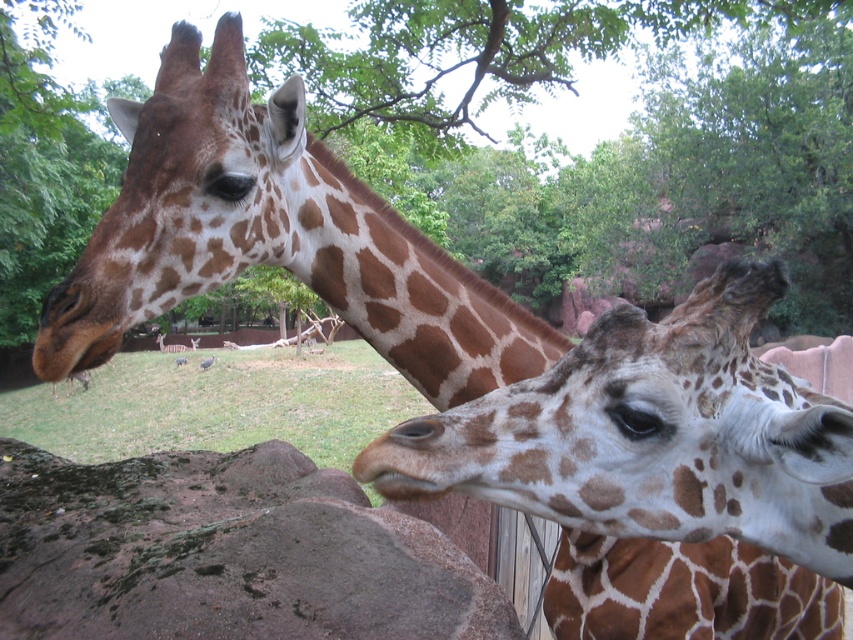
Question: Is spotted fur at center in front of brown rough rock at lower left?

Choices:
 (A) no
 (B) yes

Answer: (B)

Question: Is spotted fur at center positioned at the back of brown rough rock at lower left?

Choices:
 (A) no
 (B) yes

Answer: (A)

Question: Can you confirm if spotted fur at center is positioned to the right of brown rough rock at lower left?

Choices:
 (A) yes
 (B) no

Answer: (A)

Question: Which of the following is the farthest from the observer?

Choices:
 (A) (283, 637)
 (B) (373, 458)

Answer: (A)

Question: Which point is closer to the camera taking this photo?

Choices:
 (A) (167, 611)
 (B) (694, 387)

Answer: (B)

Question: Which point is closer to the camera?

Choices:
 (A) (149, 573)
 (B) (479, 432)

Answer: (B)